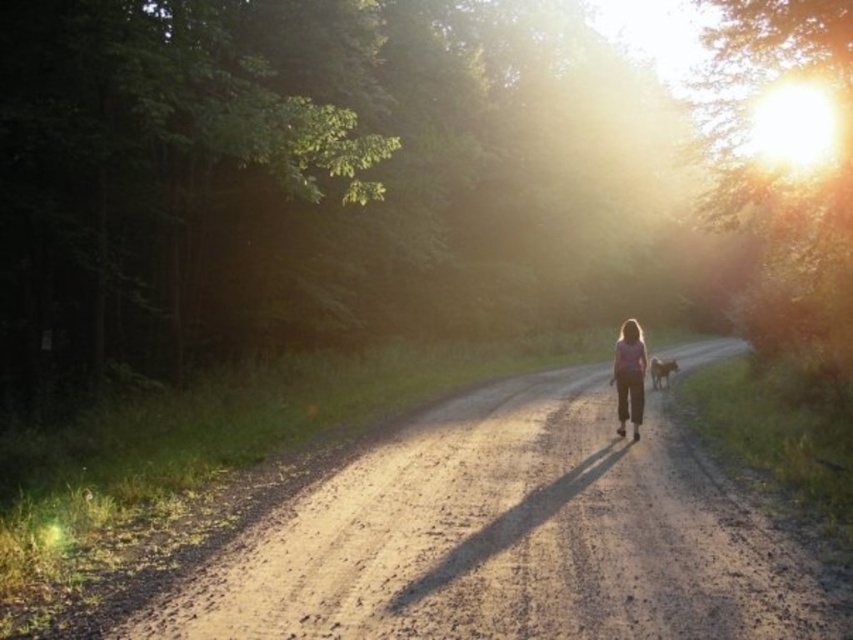
You are standing at the edge of the forest and see the dusty gravel road at center and the pink fabric girl at center. Which object is positioned to the left of the other?

The dusty gravel road at center is to the left of the pink fabric girl at center.

You are standing at the edge of the forest and want to walk to the dusty gravel road at center. The path is 5.11 meters away. If you have a walking speed of 1.5 meters per second, how many seconds will it take you to reach the road?

The dusty gravel road at center is 5.11 meters away from the viewer. At a walking speed of 1.5 meters per second, it will take approximately 3.4 seconds to reach the road.

You are standing at the point labeled as point [508,538] in the image. What is the surface you are currently standing on?

The surface at point [508,538] is a dusty gravel road at center.